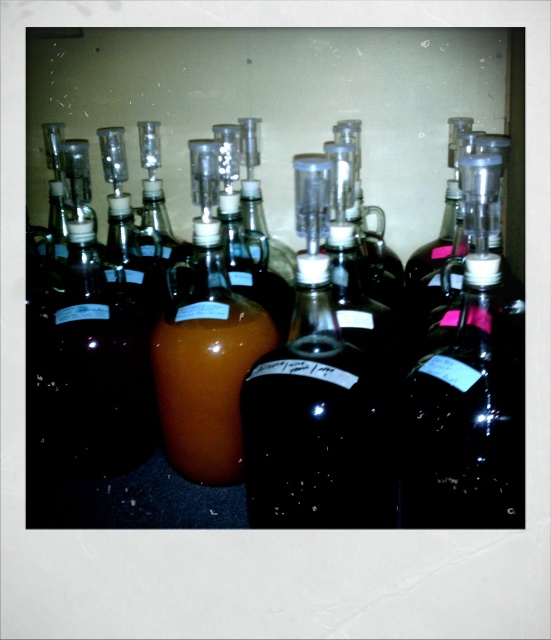
You need to pour the contents of the translucent amber liquid at center into the translucent glass bottle at center. Is the bottle large enough to hold the liquid?

The translucent glass bottle at center is bigger than the translucent amber liquid at center, so yes, the bottle can hold the liquid.

You are a brewer checking the fermentation process. You notice the translucent glass bottle at center and the translucent amber liquid at center. Which one is closer to you?

The translucent glass bottle at center is closer to you because it is in front of the translucent amber liquid at center.